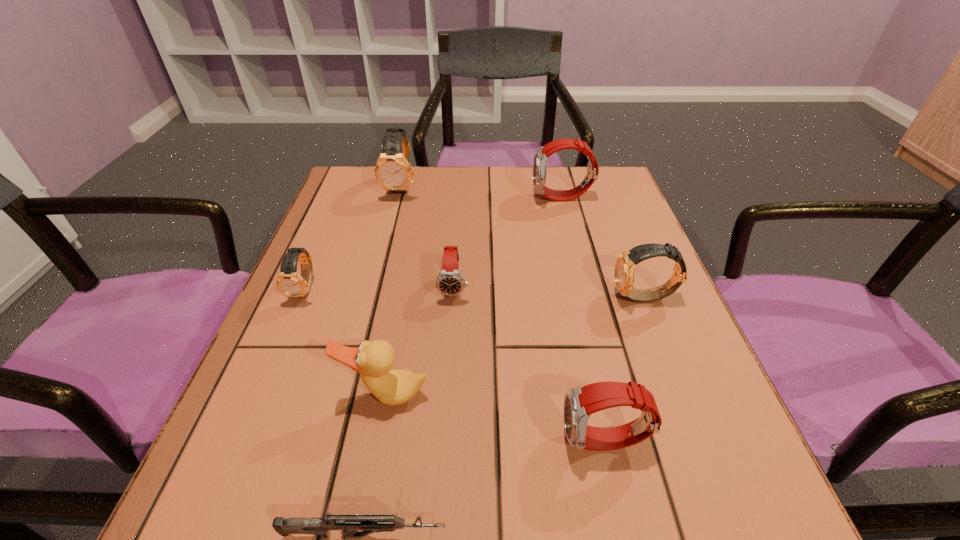
The height and width of the screenshot is (540, 960). I want to click on the smallest red watch, so click(449, 281).

Locate an element on the screen. the second nearest red watch is located at coordinates point(449,281).

You are a GUI agent. You are given a task and a screenshot of the screen. Output one action in this format:
    pyautogui.click(x=<x>, y=<y>)
    Task: Click on the vacant space located on the face of the biggest gold watch
    The height and width of the screenshot is (540, 960).
    Given the screenshot: What is the action you would take?
    pyautogui.click(x=392, y=226)

Locate an element on the screen. The width and height of the screenshot is (960, 540). vacant space positioned on the face of the biggest red watch is located at coordinates (394, 198).

Locate an element on the screen. This screenshot has width=960, height=540. vacant area located 0.210m on the face of the biggest red watch is located at coordinates (449, 198).

You are a GUI agent. You are given a task and a screenshot of the screen. Output one action in this format:
    pyautogui.click(x=<x>, y=<y>)
    Task: Click on the free space located on the face of the biggest red watch
    
    Given the screenshot: What is the action you would take?
    pyautogui.click(x=414, y=198)

This screenshot has height=540, width=960. In order to click on free region located 0.290m on the face of the rightmost gold watch in this screenshot , I will do `click(463, 298)`.

Where is `vacant space located 0.180m on the face of the rightmost gold watch`? This screenshot has width=960, height=540. vacant space located 0.180m on the face of the rightmost gold watch is located at coordinates (519, 298).

Find the location of `vacant space situated 0.260m on the face of the rightmost gold watch`. vacant space situated 0.260m on the face of the rightmost gold watch is located at coordinates (478, 298).

At what (x,y) coordinates should I click in order to perform the action: click on vacant space located on the face of the seventh farthest object. Please return your answer as a coordinate pair (x, y). The width and height of the screenshot is (960, 540). Looking at the image, I should click on (353, 442).